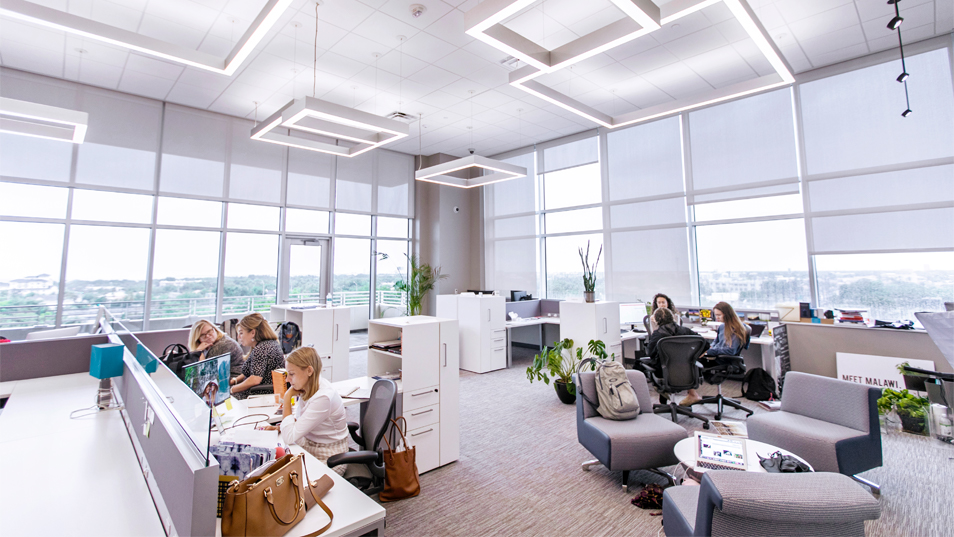
Where is `chairs`? Image resolution: width=954 pixels, height=537 pixels. chairs is located at coordinates (680, 350), (742, 324), (813, 433), (628, 426), (760, 490), (376, 410), (260, 387), (237, 358).